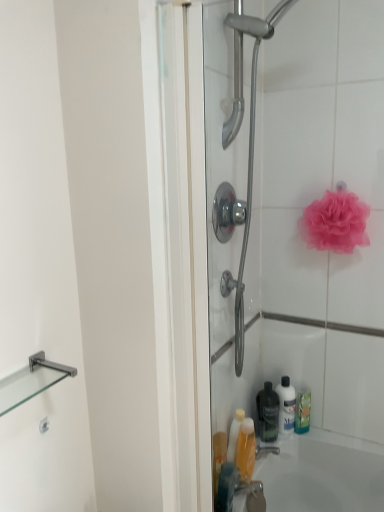
Question: Is black matte bottle at lower center to the left or to the right of translucent plastic bottle at lower center in the image?

Choices:
 (A) right
 (B) left

Answer: (A)

Question: Would you say black matte bottle at lower center is inside or outside translucent plastic bottle at lower center?

Choices:
 (A) inside
 (B) outside

Answer: (B)

Question: Estimate the real-world distances between objects in this image. Which object is closer to the black matte bottle at lower center?

Choices:
 (A) transparent glass shower door at center
 (B) yellow translucent bottle at lower center, acting as the third cleaning product starting from the back
 (C) translucent plastic bottle at lower center
 (D) pink mesh sponge at upper right
 (E) clear glass shelf at left

Answer: (C)

Question: Estimate the real-world distances between objects in this image. Which object is farther from the translucent plastic bottle at lower center?

Choices:
 (A) translucent plastic bottle at lower right, which ranks as the second cleaning product in right-to-left order
 (B) transparent glass shower door at center
 (C) black matte bottle at lower center
 (D) pink mesh sponge at upper right
 (E) clear glass shelf at left

Answer: (D)